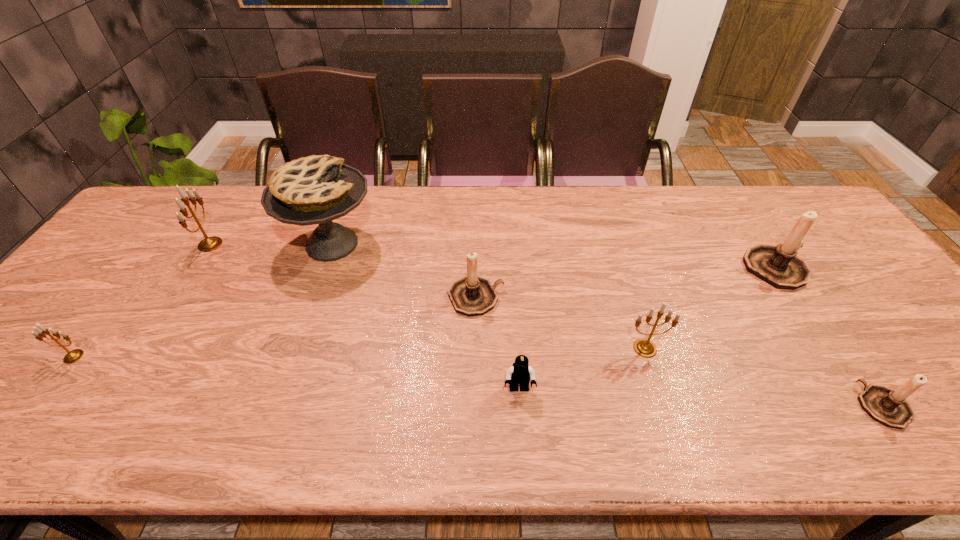
What are the coordinates of `free space located on the front of the leftmost object` in the screenshot? It's located at (54, 383).

You are a GUI agent. You are given a task and a screenshot of the screen. Output one action in this format:
    pyautogui.click(x=<x>, y=<y>)
    Task: Click on the vacant space situated 0.090m on the front-facing side of the black Lego
    
    Given the screenshot: What is the action you would take?
    pos(522,438)

This screenshot has height=540, width=960. In order to click on pie present at the far edge in this screenshot , I will do `click(312, 190)`.

Where is `candelabrum at the far edge`? candelabrum at the far edge is located at coordinates coord(208,244).

You are a GUI agent. You are given a task and a screenshot of the screen. Output one action in this format:
    pyautogui.click(x=<x>, y=<y>)
    Task: Click on the object that is at the near edge
    This screenshot has width=960, height=540.
    Given the screenshot: What is the action you would take?
    pyautogui.click(x=888, y=407)

In order to click on object that is at the left edge in this screenshot , I will do `click(72, 356)`.

At what (x,y) coordinates should I click in order to perform the action: click on vacant space at the far edge of the desktop. Please return your answer as a coordinate pair (x, y). The image size is (960, 540). Looking at the image, I should click on [x=611, y=192].

I want to click on vacant space at the near edge of the desktop, so click(669, 412).

Identify the location of free region at the left edge of the desktop. (133, 256).

Identify the location of free space at the far left corner of the desktop. This screenshot has width=960, height=540. (155, 226).